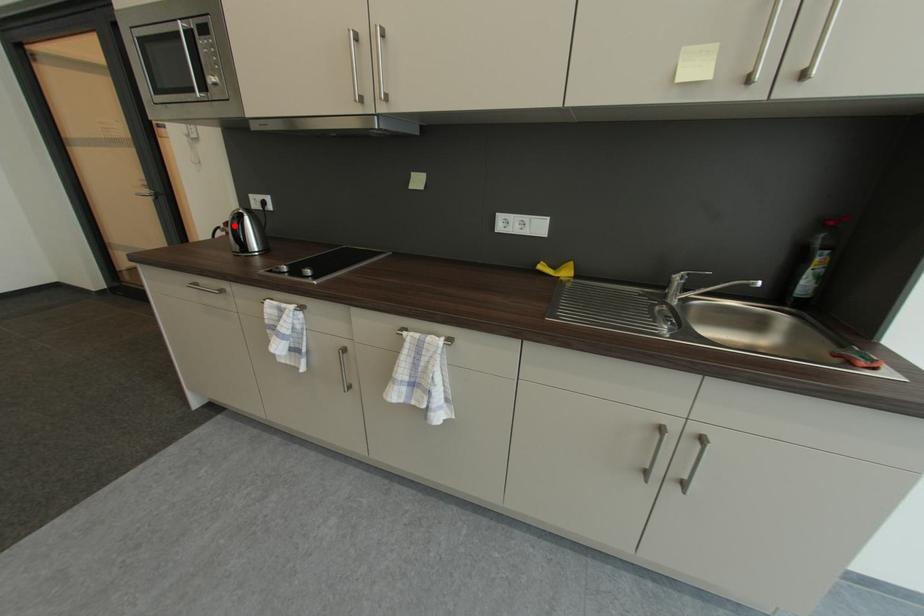
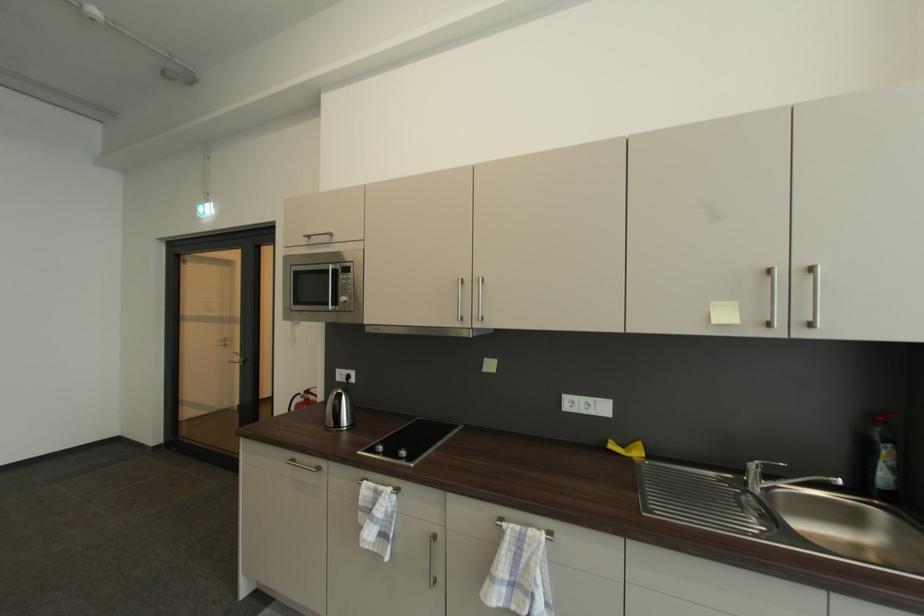
The point at the highlighted location is marked in the first image. Where is the corresponding point in the second image?

(314, 392)